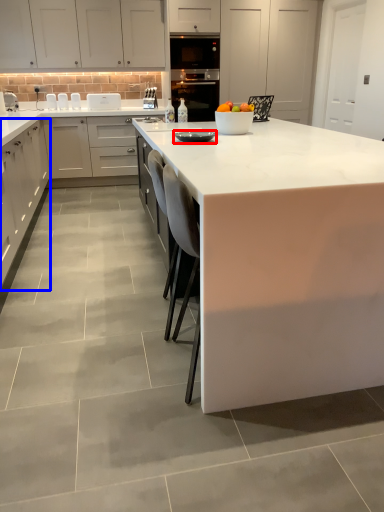
Question: Among these objects, which one is nearest to the camera, appliance (highlighted by a red box) or cabinetry (highlighted by a blue box)?

Choices:
 (A) appliance
 (B) cabinetry

Answer: (A)